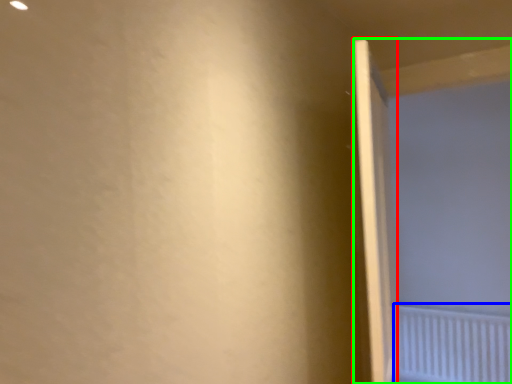
Question: Which object is positioned farthest from door (highlighted by a red box)? Select from radiator (highlighted by a blue box) and screen door (highlighted by a green box).

Choices:
 (A) radiator
 (B) screen door

Answer: (A)